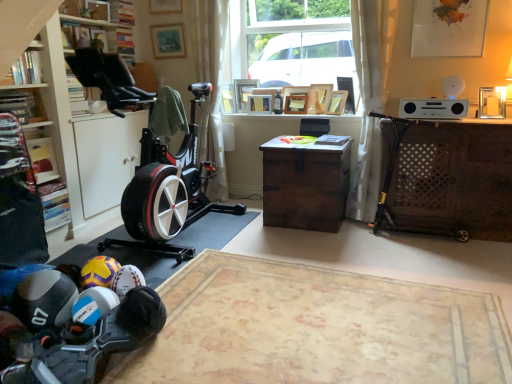
I want to click on free space between brown wooden desk at center, the 1th desk in the left-to-right sequence, and white matte baseball at lower left, the 2th toy when ordered from front to back, so click(x=236, y=254).